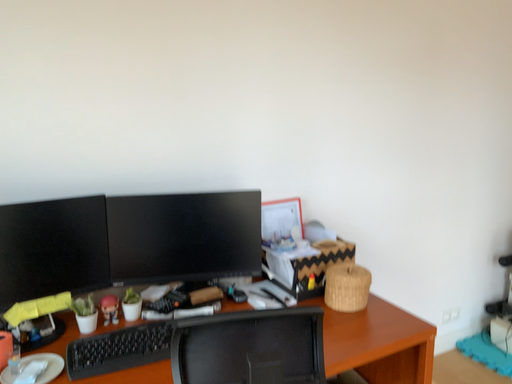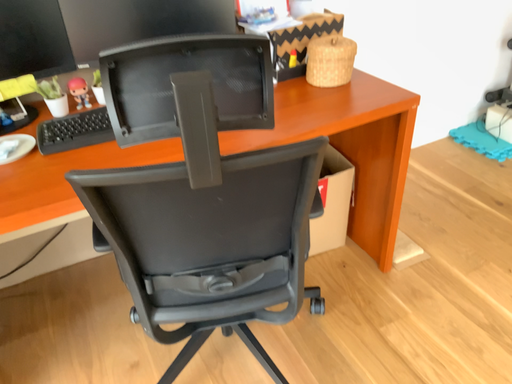
Question: How did the camera likely rotate when shooting the video?

Choices:
 (A) rotated upward
 (B) rotated downward

Answer: (B)